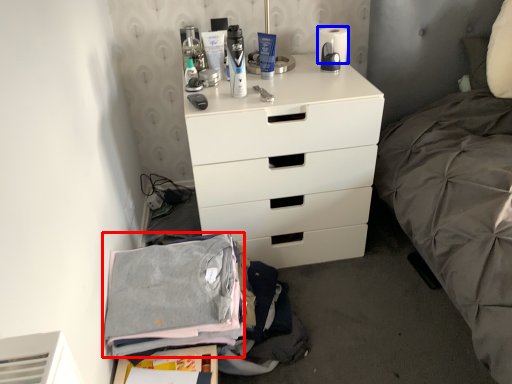
Question: Which of the following is the closest to the observer, clothing (highlighted by a red box) or toilet paper (highlighted by a blue box)?

Choices:
 (A) clothing
 (B) toilet paper

Answer: (A)